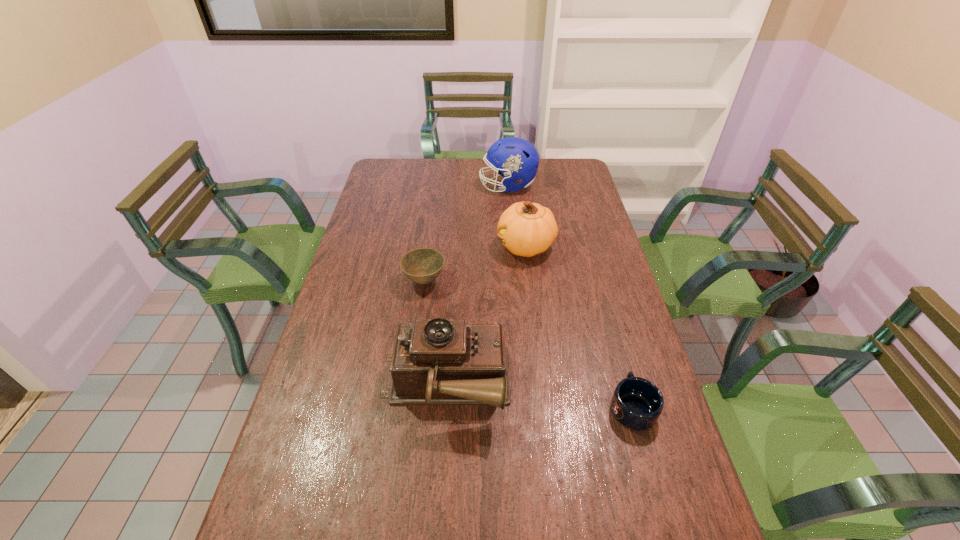
You are a GUI agent. You are given a task and a screenshot of the screen. Output one action in this format:
    pyautogui.click(x=<x>, y=<y>)
    Task: Click on the football helmet
    This screenshot has width=960, height=540.
    Given the screenshot: What is the action you would take?
    pyautogui.click(x=517, y=159)

You are a GUI agent. You are given a task and a screenshot of the screen. Output one action in this format:
    pyautogui.click(x=<x>, y=<y>)
    Task: Click on the pumpkin
    This screenshot has height=540, width=960.
    Given the screenshot: What is the action you would take?
    pyautogui.click(x=526, y=229)

You are a GUI agent. You are given a task and a screenshot of the screen. Output one action in this format:
    pyautogui.click(x=<x>, y=<y>)
    Task: Click on the phonograph_record
    The image size is (960, 540).
    Given the screenshot: What is the action you would take?
    pyautogui.click(x=435, y=362)

Identify the location of the third farthest object. This screenshot has width=960, height=540. (422, 265).

At what (x,y) coordinates should I click in order to perform the action: click on bowl. Please return your answer as a coordinate pair (x, y). Looking at the image, I should click on (422, 265).

Locate an element on the screen. The image size is (960, 540). mug is located at coordinates (637, 403).

The height and width of the screenshot is (540, 960). I want to click on the shortest object, so click(637, 403).

I want to click on vacant space situated 0.310m on the face guard of the farthest object, so click(407, 186).

Image resolution: width=960 pixels, height=540 pixels. Find the location of `free region located on the face guard of the farthest object`. free region located on the face guard of the farthest object is located at coordinates (433, 186).

Image resolution: width=960 pixels, height=540 pixels. Find the location of `vacant region located 0.190m on the face guard of the farthest object`. vacant region located 0.190m on the face guard of the farthest object is located at coordinates [x=435, y=186].